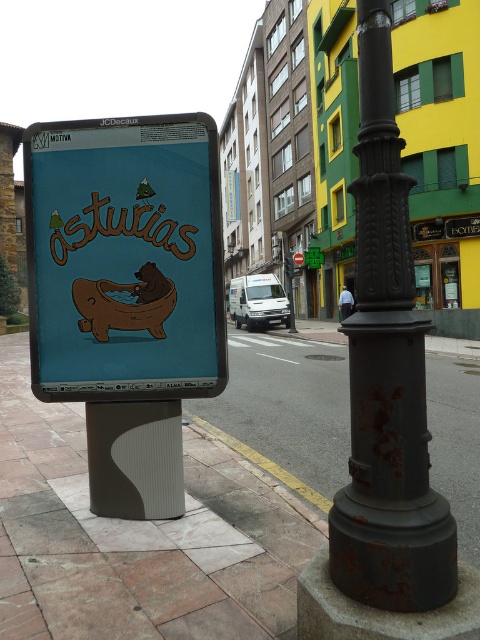
Question: Based on their relative distances, which object is farther from the matte blue signboard at center?

Choices:
 (A) green plastic sign at center
 (B) brown matte hippo at center
 (C) rusty metal pole at lower center

Answer: (A)

Question: Which point is closer to the camera?

Choices:
 (A) click(317, 260)
 (B) click(101, 400)
 (C) click(244, 381)

Answer: (B)

Question: Which object is positioned closest to the matte blue signboard at center?

Choices:
 (A) rusty metal pole at center
 (B) rusty metal pole at lower center
 (C) brown matte hippo at center

Answer: (C)

Question: Does rusty metal pole at lower center have a larger size compared to green plastic sign at center?

Choices:
 (A) no
 (B) yes

Answer: (B)

Question: Can you confirm if brown matte hippo at center is positioned below green plastic sign at center?

Choices:
 (A) yes
 (B) no

Answer: (A)

Question: Can you confirm if matte blue signboard at center is smaller than rusty metal pole at center?

Choices:
 (A) no
 (B) yes

Answer: (A)